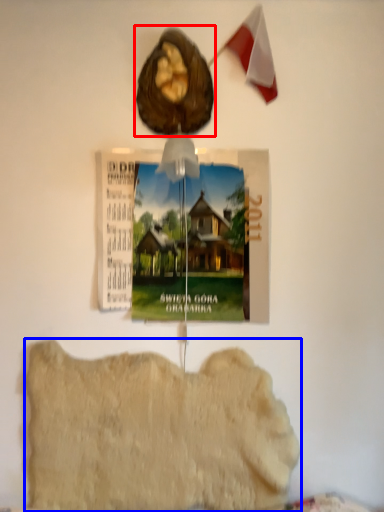
Question: Which point is further to the camera, animal (highlighted by a red box) or food (highlighted by a blue box)?

Choices:
 (A) animal
 (B) food

Answer: (B)